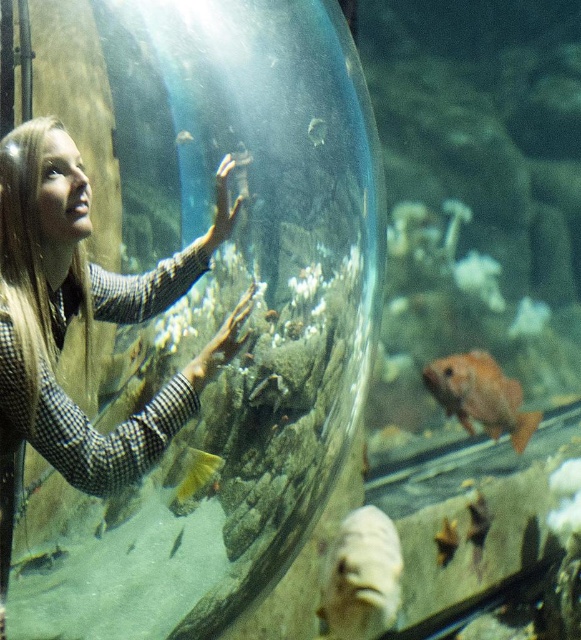
Is blonde hair at left wider than white matte fish at lower center?

No.

Is blonde hair at left bigger than white matte fish at lower center?

No.

Identify the location of blonde hair at left. This screenshot has width=581, height=640. (85, 312).

Based on the photo, which is more to the left, orange matte fish at lower right or shiny yellow fish at center?

Positioned to the left is shiny yellow fish at center.

The image size is (581, 640). In order to click on orange matte fish at lower right in this screenshot , I will do `click(480, 396)`.

Is point (443, 356) more distant than point (193, 468)?

That is True.

I want to click on orange matte fish at lower right, so click(x=480, y=396).

Where is `shiny silver fish at center`? shiny silver fish at center is located at coordinates (184, 136).

Between point (181, 134) and point (270, 310), which one is positioned behind?

Positioned behind is point (270, 310).

Find the location of `shiny silver fish at center`. shiny silver fish at center is located at coordinates (184, 136).